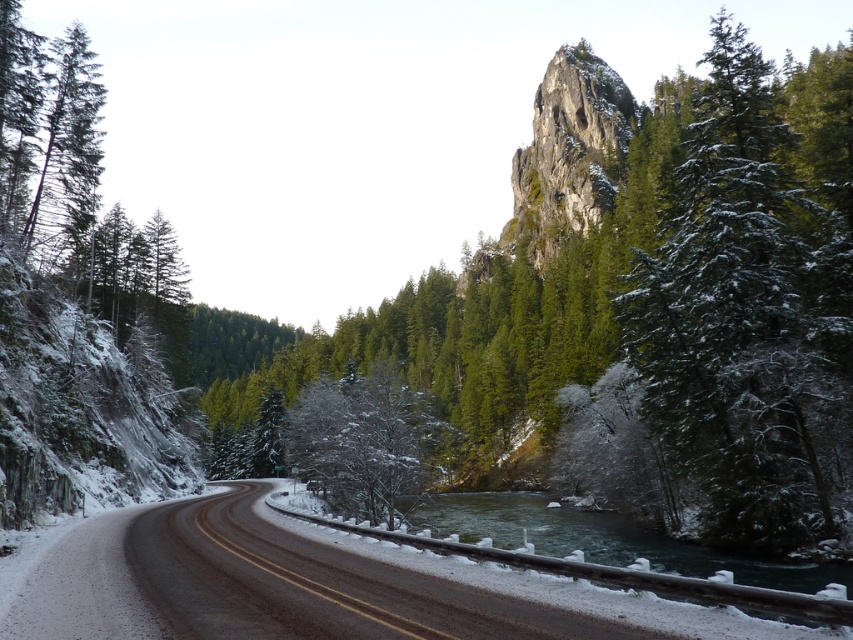
Question: Which of these objects is positioned farthest from the green matte tree at upper right?

Choices:
 (A) black asphalt highway at center
 (B) greenish-blue water at center

Answer: (A)

Question: Which of the following is the farthest from the observer?

Choices:
 (A) (782, 561)
 (B) (558, 618)
 (C) (697, 428)

Answer: (C)

Question: From the image, what is the correct spatial relationship of black asphalt highway at center in relation to greenish-blue water at center?

Choices:
 (A) below
 (B) above

Answer: (B)

Question: Can you confirm if green matte tree at upper right is wider than greenish-blue water at center?

Choices:
 (A) no
 (B) yes

Answer: (B)

Question: From the image, what is the correct spatial relationship of green matte tree at upper right in relation to black asphalt highway at center?

Choices:
 (A) below
 (B) above

Answer: (B)

Question: Which object appears closest to the camera in this image?

Choices:
 (A) greenish-blue water at center
 (B) black asphalt highway at center

Answer: (A)